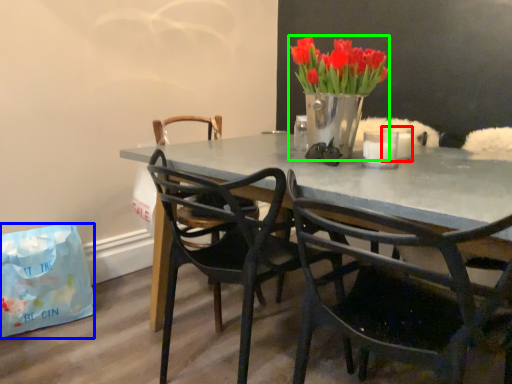
Question: Which object is positioned farthest from candle (highlighted by a red box)? Select from handbag (highlighted by a blue box) and houseplant (highlighted by a green box).

Choices:
 (A) handbag
 (B) houseplant

Answer: (A)